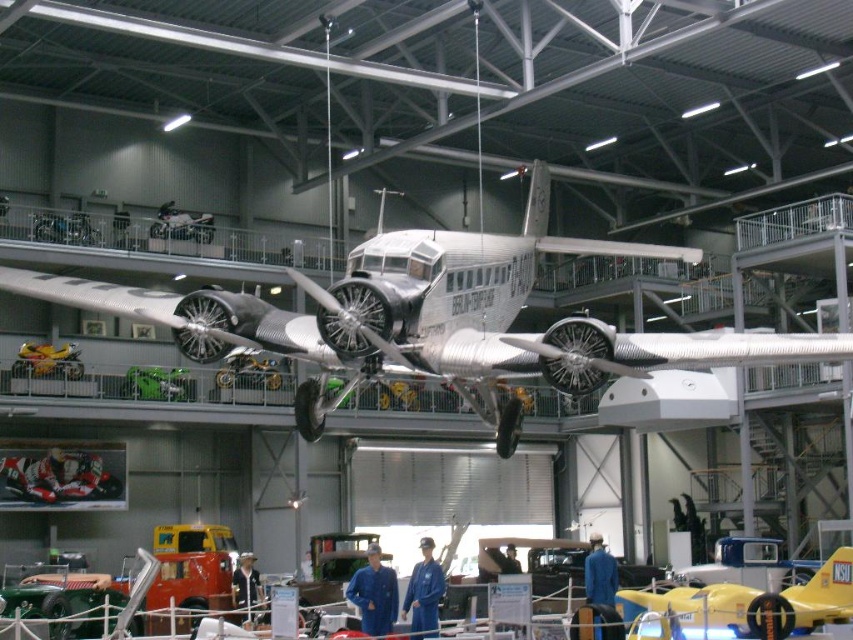
Question: Which point is closer to the camera taking this photo?

Choices:
 (A) (717, 332)
 (B) (715, 592)

Answer: (A)

Question: Does polished aluminum airplane at center have a lesser width compared to yellow glossy airplane at center?

Choices:
 (A) no
 (B) yes

Answer: (A)

Question: Among these points, which one is nearest to the camera?

Choices:
 (A) [x=341, y=342]
 (B) [x=781, y=595]

Answer: (A)

Question: Is polished aluminum airplane at center bigger than yellow glossy airplane at center?

Choices:
 (A) no
 (B) yes

Answer: (B)

Question: Which object is closer to the camera taking this photo?

Choices:
 (A) yellow glossy airplane at center
 (B) polished aluminum airplane at center

Answer: (B)

Question: From the image, what is the correct spatial relationship of polished aluminum airplane at center in relation to yellow glossy airplane at center?

Choices:
 (A) above
 (B) below

Answer: (A)